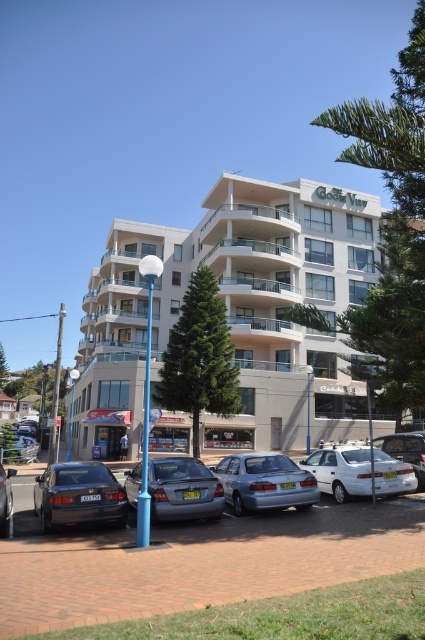
Question: Does metallic blue sedan at center have a smaller size compared to matte gray sedan at left?

Choices:
 (A) yes
 (B) no

Answer: (A)

Question: Which of the following is the farthest from the observer?

Choices:
 (A) (198, 225)
 (B) (246, 499)
 (C) (0, 532)
 (D) (333, 458)

Answer: (A)

Question: Estimate the real-world distances between objects in this image. Which object is farther from the matte black sedan at lower left?

Choices:
 (A) beige concrete building at center
 (B) satin silver sedan at center
 (C) white glossy sedan at center
 (D) metallic silver car at center

Answer: (A)

Question: Which point appears farthest from the camera in this image?

Choices:
 (A) pyautogui.click(x=268, y=337)
 (B) pyautogui.click(x=27, y=497)
 (C) pyautogui.click(x=408, y=467)

Answer: (A)

Question: Can you confirm if white glossy sedan at center is wider than matte gray sedan at left?

Choices:
 (A) yes
 (B) no

Answer: (B)

Question: Is metallic blue sedan at center smaller than matte gray sedan at left?

Choices:
 (A) yes
 (B) no

Answer: (A)